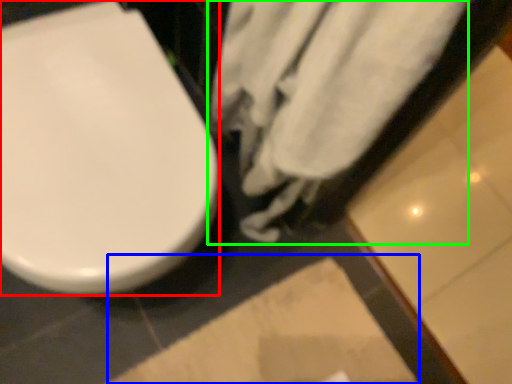
Question: Estimate the real-world distances between objects in this image. Which object is farther from toilet (highlighted by a red box), square (highlighted by a blue box) or bath towel (highlighted by a green box)?

Choices:
 (A) square
 (B) bath towel

Answer: (A)